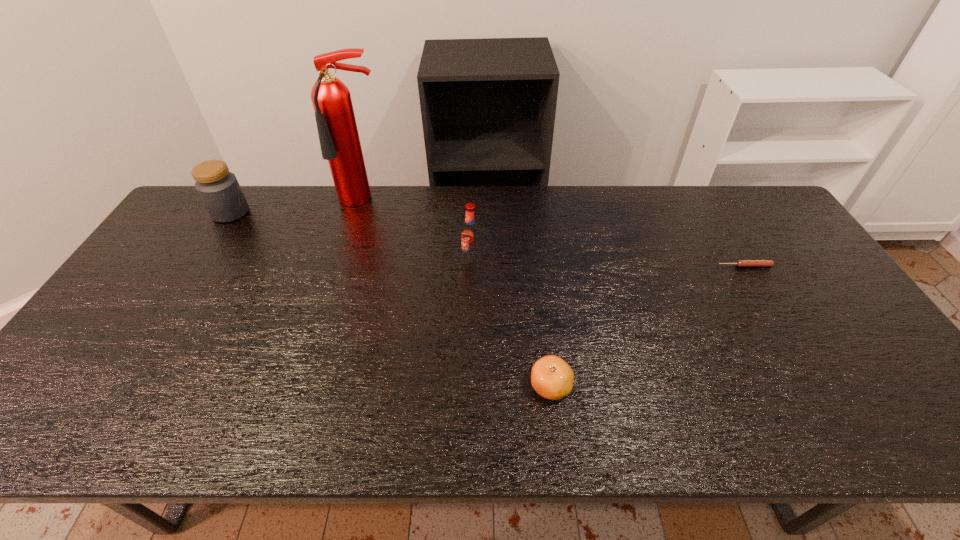
The height and width of the screenshot is (540, 960). Find the location of `free space located 0.290m on the surface of the jar near the warning symbol`. free space located 0.290m on the surface of the jar near the warning symbol is located at coordinates (335, 212).

Identify the location of vacant space located 0.390m on the left of the clementine. The width and height of the screenshot is (960, 540). tap(362, 386).

At what (x,y) coordinates should I click in order to perform the action: click on free location located 0.050m on the front of the sausage. Please return your answer as a coordinate pair (x, y). The image size is (960, 540). Looking at the image, I should click on (754, 281).

This screenshot has width=960, height=540. In order to click on fire extinguisher present at the far edge in this screenshot , I will do `click(339, 139)`.

Image resolution: width=960 pixels, height=540 pixels. Find the location of `jar located at the far edge`. jar located at the far edge is located at coordinates (219, 190).

Identify the location of object at the near edge. (552, 378).

At what (x,y) coordinates should I click in order to perform the action: click on object at the left edge. Please return your answer as a coordinate pair (x, y). This screenshot has height=540, width=960. Looking at the image, I should click on (219, 190).

Image resolution: width=960 pixels, height=540 pixels. I want to click on object positioned at the right edge, so [x=740, y=263].

The width and height of the screenshot is (960, 540). I want to click on object present at the far left corner, so click(219, 190).

Locate an element on the screen. Image resolution: width=960 pixels, height=540 pixels. blank space at the far edge of the desktop is located at coordinates (551, 201).